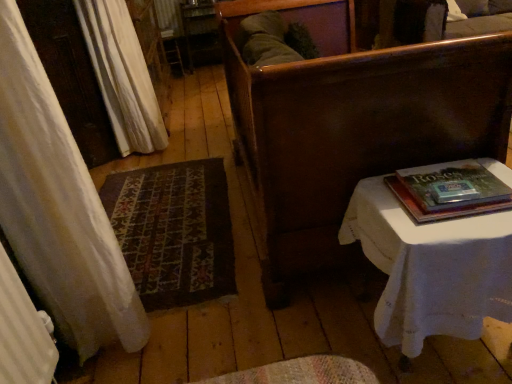
Question: Does dark brown wood bench at center appear on the left side of white cloth-covered table at right?

Choices:
 (A) yes
 (B) no

Answer: (A)

Question: From a real-world perspective, is dark brown wood bench at center on white cloth-covered table at right?

Choices:
 (A) no
 (B) yes

Answer: (B)

Question: Can you confirm if dark brown wood bench at center is shorter than white cloth-covered table at right?

Choices:
 (A) no
 (B) yes

Answer: (A)

Question: Considering the relative positions of dark brown wood bench at center and white cloth-covered table at right in the image provided, is dark brown wood bench at center to the right of white cloth-covered table at right from the viewer's perspective?

Choices:
 (A) no
 (B) yes

Answer: (A)

Question: Is dark brown wood bench at center looking in the opposite direction of white cloth-covered table at right?

Choices:
 (A) yes
 (B) no

Answer: (B)

Question: In terms of height, does hardcover book at right look taller or shorter compared to dark brown wood bench at center?

Choices:
 (A) short
 (B) tall

Answer: (A)

Question: Is hardcover book at right in front of or behind dark brown wood bench at center in the image?

Choices:
 (A) behind
 (B) front

Answer: (A)

Question: Would you say hardcover book at right is to the left or to the right of dark brown wood bench at center in the picture?

Choices:
 (A) left
 (B) right

Answer: (B)

Question: In terms of size, does hardcover book at right appear bigger or smaller than dark brown wood bench at center?

Choices:
 (A) small
 (B) big

Answer: (A)

Question: From their relative heights in the image, would you say white cloth-covered table at right is taller or shorter than white fabric curtain at upper left?

Choices:
 (A) tall
 (B) short

Answer: (B)

Question: Considering the positions of point (398, 334) and point (122, 18), is point (398, 334) closer or farther from the camera than point (122, 18)?

Choices:
 (A) closer
 (B) farther

Answer: (A)

Question: Do you think white cloth-covered table at right is within white fabric curtain at upper left, or outside of it?

Choices:
 (A) outside
 (B) inside

Answer: (A)

Question: From a real-world perspective, is white cloth-covered table at right positioned above or below white fabric curtain at upper left?

Choices:
 (A) above
 (B) below

Answer: (B)

Question: Is hardcover book at right bigger or smaller than white fabric curtain at upper left?

Choices:
 (A) big
 (B) small

Answer: (B)

Question: Is point (414, 218) closer or farther from the camera than point (106, 33)?

Choices:
 (A) farther
 (B) closer

Answer: (B)